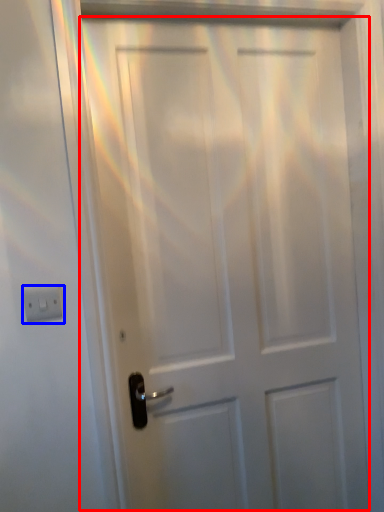
Question: Which point is further to the camera, door (highlighted by a red box) or light switch (highlighted by a blue box)?

Choices:
 (A) door
 (B) light switch

Answer: (A)